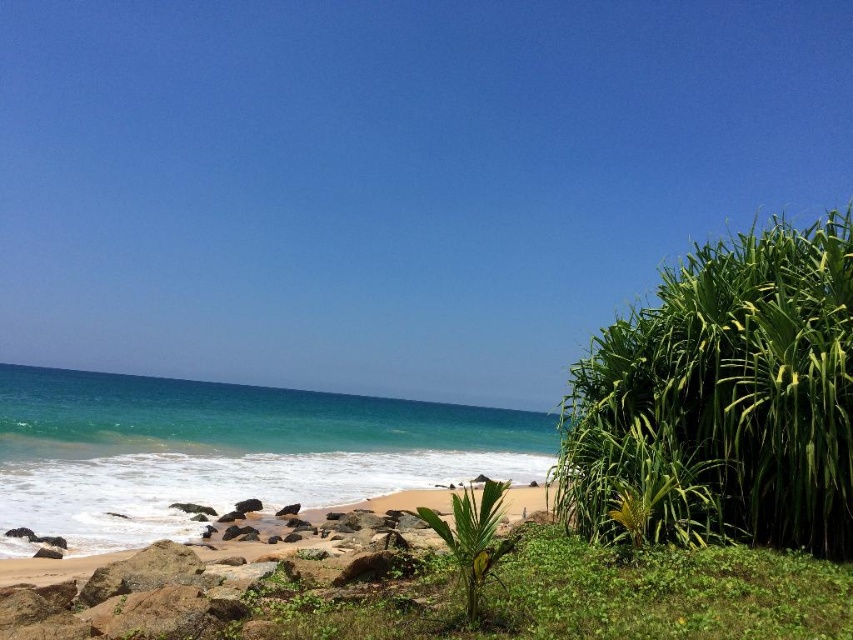
From the picture: You are standing at the point marked as point (225, 451) and want to walk towards the green vegetation on the right. Which direction should you face to walk towards it?

You should face towards the right direction to walk towards the green vegetation on the right from point (225, 451).

You are a photographer trying to capture the entire scene of the green leafy bush at right and the turquoise glossy water at center in one shot. Based on their sizes in the image, which object would require you to step back more to include both in the frame?

The green leafy bush at right occupies less space than the turquoise glossy water at center, so you would need to step back more to include both the green leafy bush at right and the turquoise glossy water at center in the frame because the turquoise glossy water at center takes up more space and would be harder to fit into the shot without cropping.